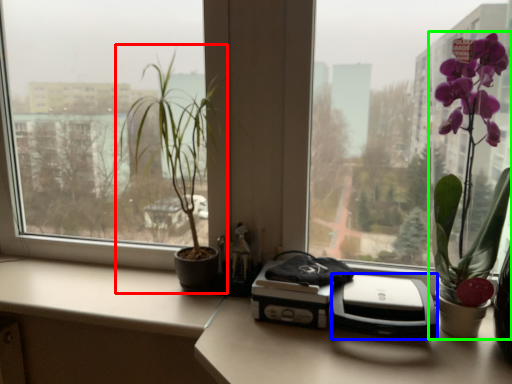
Question: Based on their relative distances, which object is farther from houseplant (highlighted by a red box)? Choose from printer (highlighted by a blue box) and houseplant (highlighted by a green box).

Choices:
 (A) printer
 (B) houseplant

Answer: (B)